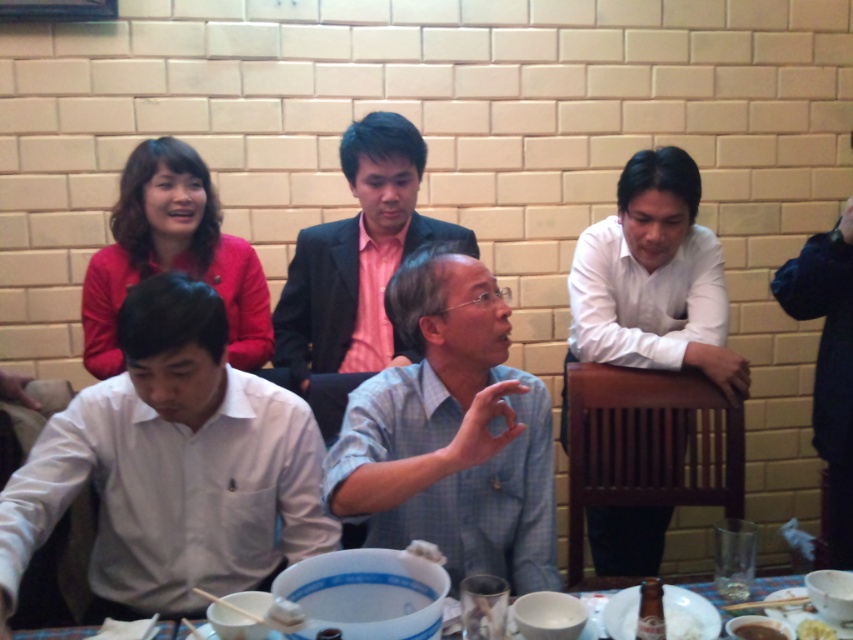
Question: Can you confirm if pink satin shirt at center is thinner than black leather jacket at right?

Choices:
 (A) yes
 (B) no

Answer: (B)

Question: Is white smooth shirt at right bigger than black leather jacket at right?

Choices:
 (A) no
 (B) yes

Answer: (B)

Question: Which object is the closest to the white smooth shirt at right?

Choices:
 (A) yellow matte rice at lower right
 (B) white plastic bowl at lower center
 (C) gray checkered shirt at center

Answer: (C)

Question: Which of the following is the closest to the observer?

Choices:
 (A) white matte shirt at center
 (B) brown matte bowl at lower center
 (C) yellow matte rice at lower right

Answer: (A)

Question: Which object is positioned farthest from the white matte shirt at center?

Choices:
 (A) black leather jacket at right
 (B) white plastic bowl at lower center
 (C) yellow matte rice at lower right

Answer: (A)

Question: Is gray checkered shirt at center above yellow matte rice at lower right?

Choices:
 (A) yes
 (B) no

Answer: (A)